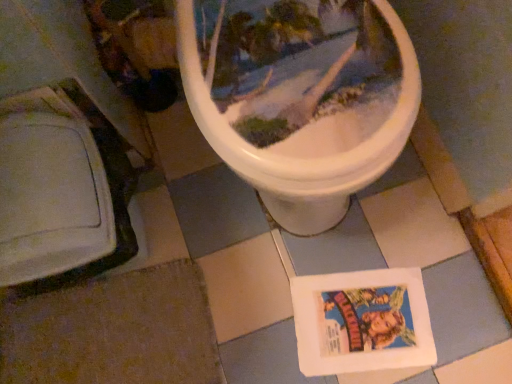
This screenshot has width=512, height=384. I want to click on blank area to the left of white paper comic book at lower center, so click(247, 313).